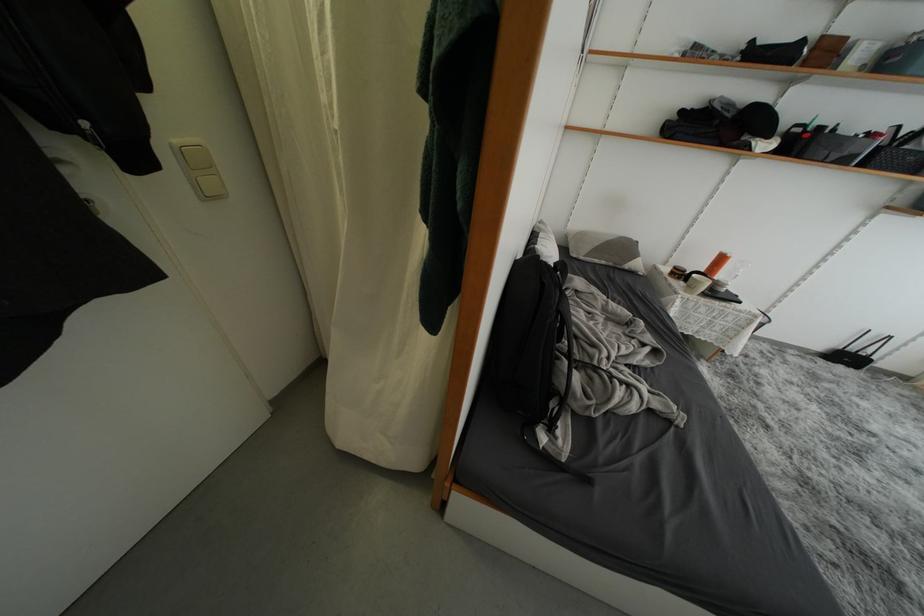
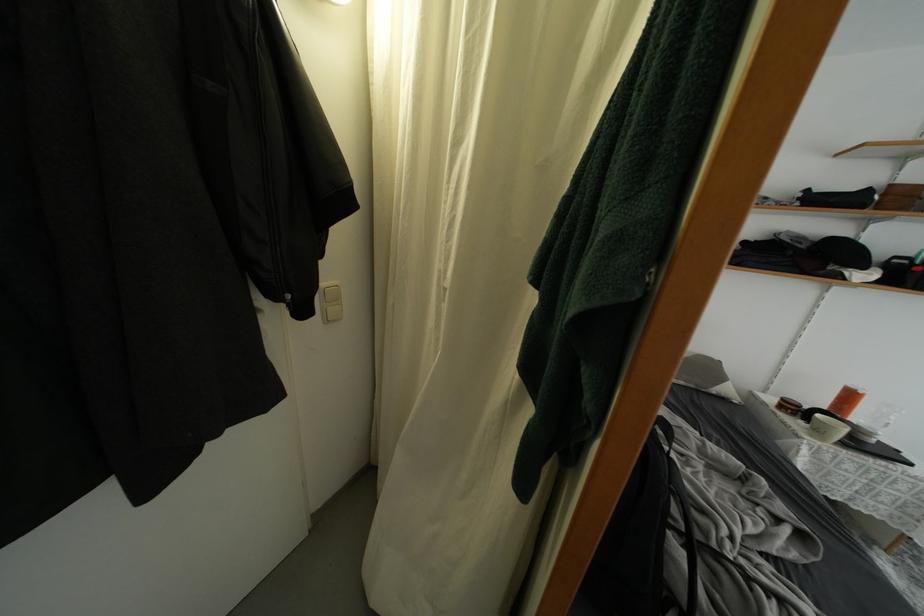
In the second image, find the point that corresponds to pixel 726 264 in the first image.

(856, 400)